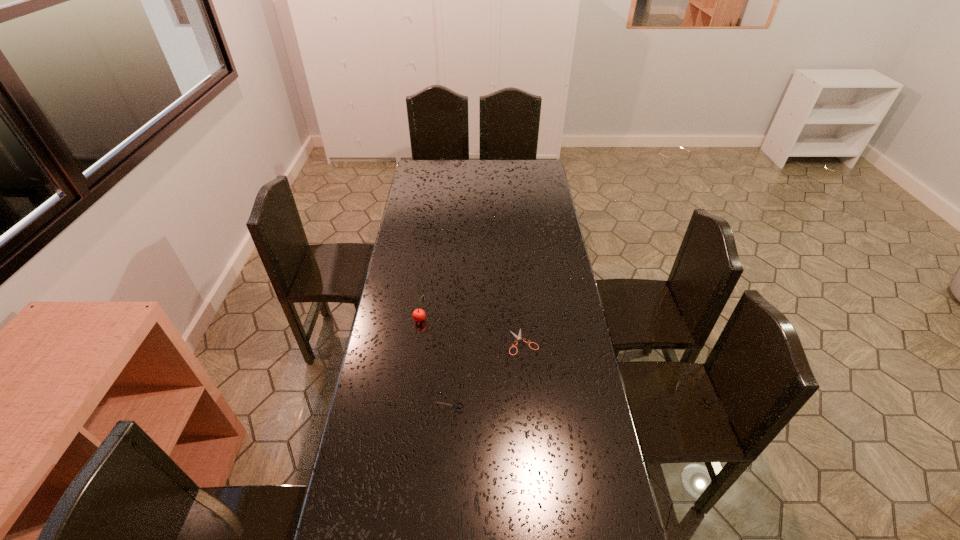
You are a GUI agent. You are given a task and a screenshot of the screen. Output one action in this format:
    pyautogui.click(x=<x>, y=<y>)
    Task: Click on the free space at the far edge
    
    Given the screenshot: What is the action you would take?
    pyautogui.click(x=479, y=162)

Image resolution: width=960 pixels, height=540 pixels. In the image, there is a desktop. What are the coordinates of `free space at the left edge` in the screenshot? It's located at (432, 223).

Where is `free space at the right edge of the desktop`? free space at the right edge of the desktop is located at coordinates (552, 295).

Locate an element on the screen. The height and width of the screenshot is (540, 960). vacant space at the far left corner is located at coordinates (440, 179).

Identify the location of free point at the far right corner. This screenshot has height=540, width=960. (542, 162).

In order to click on empty space that is in between the second tallest object and the farther shears in this screenshot , I will do `click(486, 374)`.

Locate an element on the screen. empty location between the nearer shears and the farther shears is located at coordinates (486, 374).

The image size is (960, 540). In order to click on free spot between the right shears and the leftmost object in this screenshot , I will do 471,330.

I want to click on empty location between the leftmost object and the rightmost object, so pos(471,330).

The height and width of the screenshot is (540, 960). I want to click on free space between the second object from right to left and the cherry, so click(435, 363).